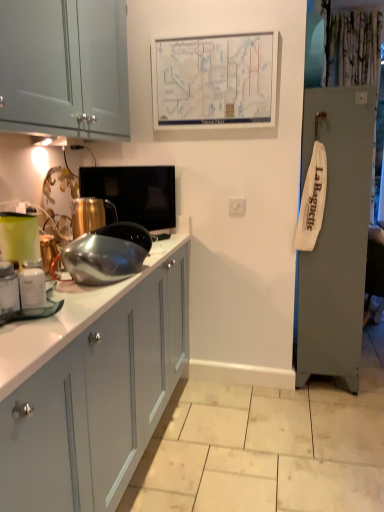
Question: In the image, is shiny metallic kettle at center-left, the 3th appliance from the front, on the left side or the right side of matte green plastic container at left?

Choices:
 (A) left
 (B) right

Answer: (B)

Question: From the image's perspective, is shiny metallic kettle at center-left, the 3th appliance from the front, positioned above or below matte green plastic container at left?

Choices:
 (A) below
 (B) above

Answer: (B)

Question: Which is farther from the white glossy jar at left, the fourth appliance from the back?

Choices:
 (A) matte white salt shaker at left
 (B) white paper map at upper center
 (C) matte black tv at center, arranged as the fourth appliance when viewed from the front
 (D) shiny metallic kettle at center-left, the 3th appliance from the front
 (E) matte green plastic container at left

Answer: (B)

Question: Estimate the real-world distances between objects in this image. Which object is farther from the matte green plastic container at left?

Choices:
 (A) shiny metallic kettle at center-left, the 2th appliance when ordered from back to front
 (B) matte black tv at center, positioned as the 1th appliance in back-to-front order
 (C) matte white salt shaker at left
 (D) shiny metallic bowl at center, which is counted as the 2th appliance, starting from the front
 (E) white paper map at upper center

Answer: (E)